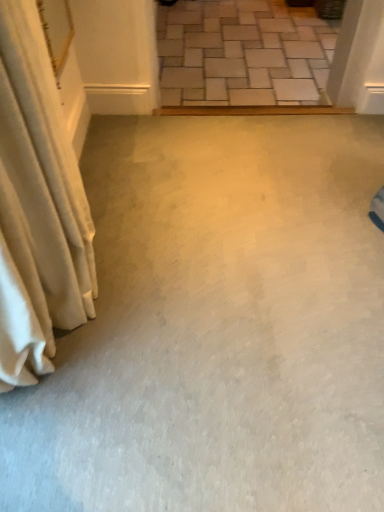
Locate an element on the screen. free space in front of white fabric curtain at left is located at coordinates (106, 439).